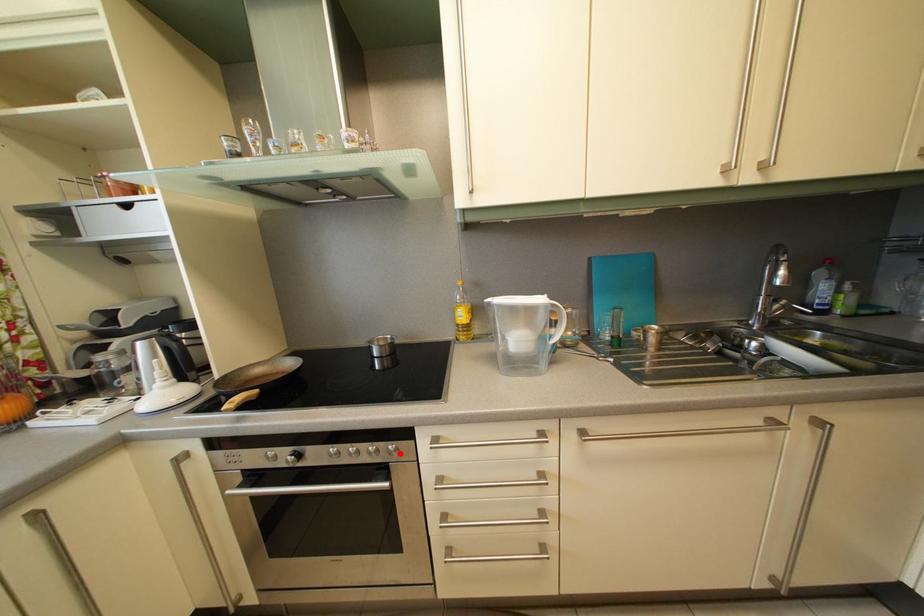
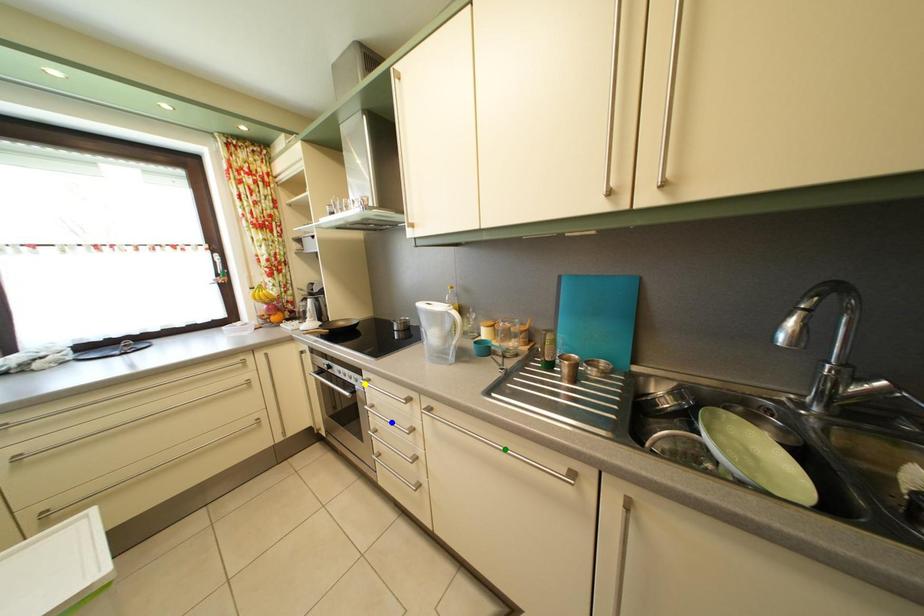
Question: I am providing you with two images of the same scene from different viewpoints. A red point is marked on the first image. You are given multiple points on the second image. Which point in image 2 is actually the same real-world point as the red point in image 1?

Choices:
 (A) blue point
 (B) yellow point
 (C) green point

Answer: (B)